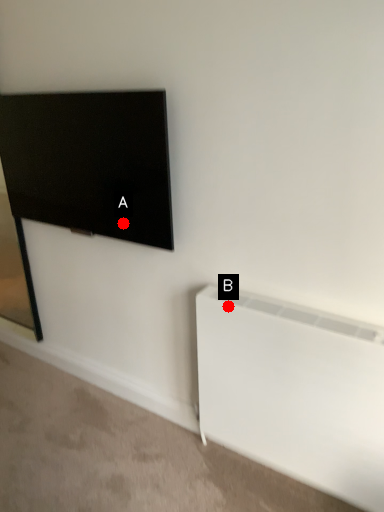
Question: Two points are circled on the image, labeled by A and B beside each circle. Which point is closer to the camera taking this photo?

Choices:
 (A) A is closer
 (B) B is closer

Answer: (B)